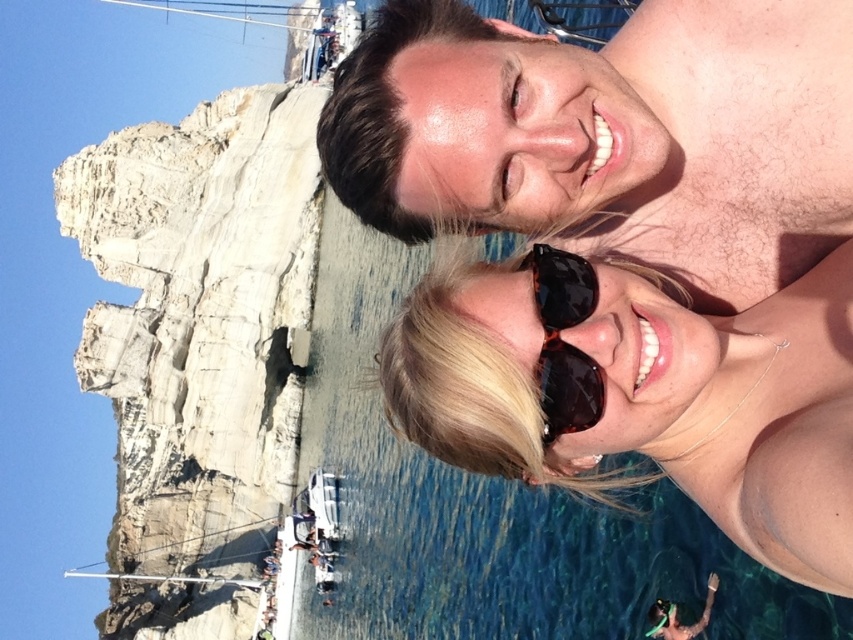
You are a photographer trying to capture both the brown shiny sunglasses at upper center and the tortoiseshell sunglasses at center in a single frame. Which sunglasses should you focus on first to ensure both are in focus, considering their sizes?

The brown shiny sunglasses at upper center is much taller than the tortoiseshell sunglasses at center, so you should focus on the brown shiny sunglasses at upper center first to ensure both are in focus.

You are a photographer trying to capture a photo of the white rocky cliff at left and the tortoiseshell sunglasses at center. Which object should you focus on first if you want to ensure both are in sharp focus?

The white rocky cliff at left is positioned under the tortoiseshell sunglasses at center, so focusing on the white rocky cliff at left first would help ensure both are in sharp focus since it is closer to the camera.